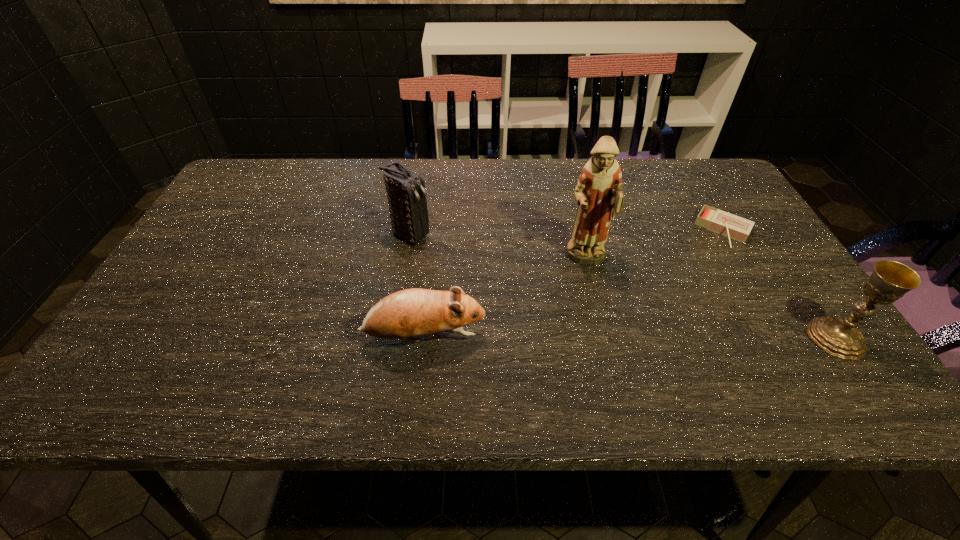
Image resolution: width=960 pixels, height=540 pixels. In order to click on the fourth tallest object in this screenshot , I will do `click(415, 312)`.

Identify the location of chalice. (890, 280).

Where is `clutch bag`? This screenshot has width=960, height=540. clutch bag is located at coordinates (406, 194).

You are a GUI agent. You are given a task and a screenshot of the screen. Output one action in this format:
    pyautogui.click(x=<x>, y=<y>)
    Task: Click on the figurine
    This screenshot has height=540, width=960.
    Given the screenshot: What is the action you would take?
    pyautogui.click(x=599, y=193)

Find the location of a particular element. The height and width of the screenshot is (540, 960). the tallest object is located at coordinates tap(599, 193).

This screenshot has height=540, width=960. What are the coordinates of `matchbox` in the screenshot? It's located at (735, 227).

Find the location of `free region located 0.180m at the face of the hamster`. free region located 0.180m at the face of the hamster is located at coordinates (569, 338).

Locate an element on the screen. The image size is (960, 540). vacant space located 0.230m on the back of the chalice is located at coordinates pos(774,248).

Locate an element on the screen. The width and height of the screenshot is (960, 540). free space located 0.210m with the zip open on the clutch bag is located at coordinates (492, 278).

At what (x,y) coordinates should I click in order to perform the action: click on vacant space located with the zip open on the clutch bag. Please return your answer as a coordinate pair (x, y). Looking at the image, I should click on click(492, 278).